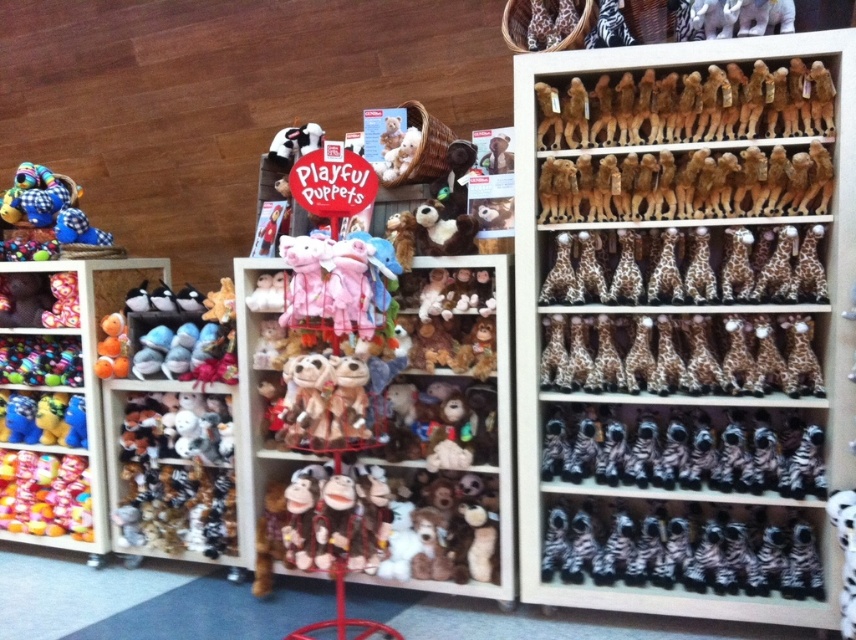
Is soft plush toys at center to the left of zebra-striped plush at right from the viewer's perspective?

Indeed, soft plush toys at center is positioned on the left side of zebra-striped plush at right.

The width and height of the screenshot is (856, 640). I want to click on soft plush toys at center, so click(x=383, y=428).

The width and height of the screenshot is (856, 640). Identify the location of soft plush toys at center. (383, 428).

Does zebra-striped plush at right appear on the right side of brown plush monkey at upper right?

Indeed, zebra-striped plush at right is positioned on the right side of brown plush monkey at upper right.

Which of these two, zebra-striped plush at right or brown plush monkey at upper right, stands taller?

With more height is zebra-striped plush at right.

Identify the location of zebra-striped plush at right. (682, 548).

Is brown plush giraffes at right shorter than translucent plastic candy at lower left?

No.

Who is positioned more to the right, brown plush giraffes at right or translucent plastic candy at lower left?

Positioned to the right is brown plush giraffes at right.

Where is `brown plush giraffes at right`? The height and width of the screenshot is (640, 856). brown plush giraffes at right is located at coordinates click(684, 324).